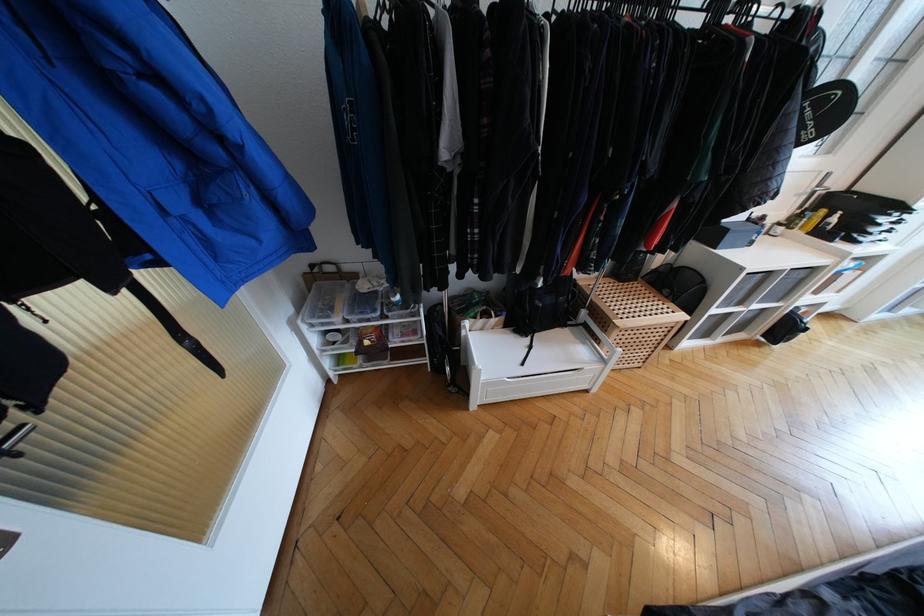
Find where to lift the small black box. Please return your answer as a coordinate pair (x, y).

(728, 235)